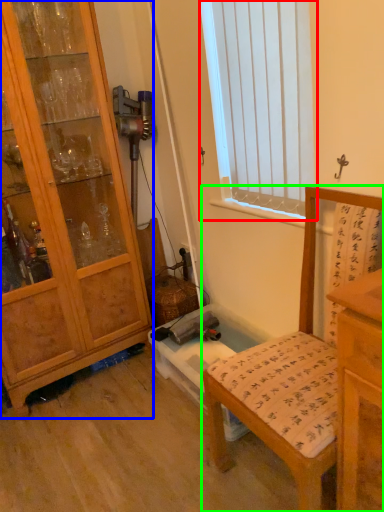
Question: Which object is the closest to the window (highlighted by a red box)? Choose among these: cabinetry (highlighted by a blue box) or chair (highlighted by a green box).

Choices:
 (A) cabinetry
 (B) chair

Answer: (A)